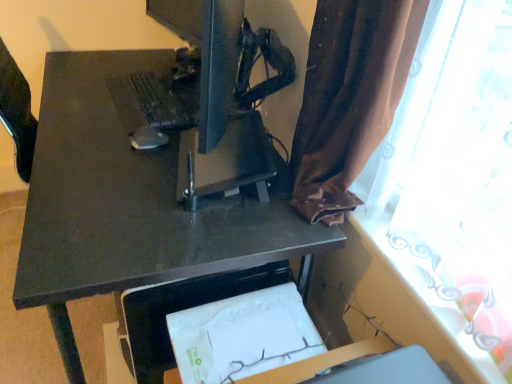
Identify the location of free space in front of matte black mouse at center. This screenshot has height=384, width=512. (128, 165).